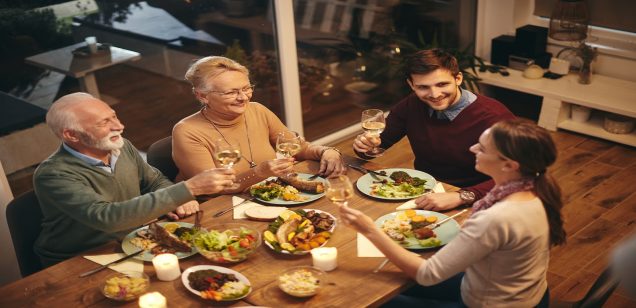
Locate an element on the screen. The height and width of the screenshot is (308, 636). wine glasses is located at coordinates (232, 150), (287, 145), (373, 121), (336, 186).